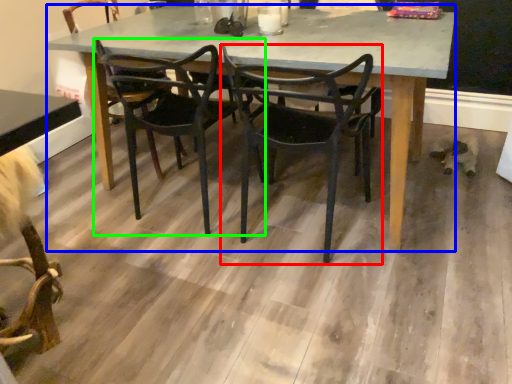
Question: Considering the real-world distances, which object is closest to chair (highlighted by a red box)? kitchen & dining room table (highlighted by a blue box) or chair (highlighted by a green box).

Choices:
 (A) kitchen & dining room table
 (B) chair

Answer: (A)